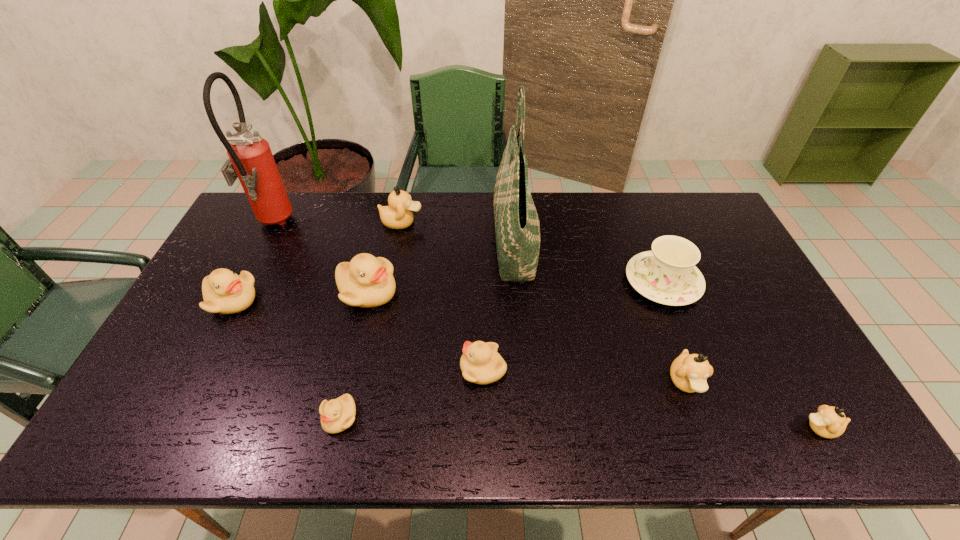
Locate an element on the screen. The height and width of the screenshot is (540, 960). green tote bag is located at coordinates (517, 227).

Locate an element on the screen. fire extinguisher is located at coordinates (251, 160).

Find the location of a particular element. Image resolution: width=960 pixels, height=540 pixels. the farthest tan duckling is located at coordinates (398, 215).

Locate an element on the screen. the leftmost tan duckling is located at coordinates (398, 215).

Find the location of a particular element. the biggest yellow duckling is located at coordinates (366, 281).

The image size is (960, 540). I want to click on chinaware, so pyautogui.click(x=667, y=275).

Locate an element on the screen. This screenshot has height=540, width=960. the leftmost yellow duckling is located at coordinates (225, 292).

Find the location of a particular element. This screenshot has height=540, width=960. the third smallest yellow duckling is located at coordinates (225, 292).

Where is `the second tan duckling from left to right`? This screenshot has width=960, height=540. the second tan duckling from left to right is located at coordinates (689, 373).

At what (x,y) coordinates should I click in order to perform the action: click on the second smallest tan duckling. Please return your answer as a coordinate pair (x, y). Looking at the image, I should click on (689, 373).